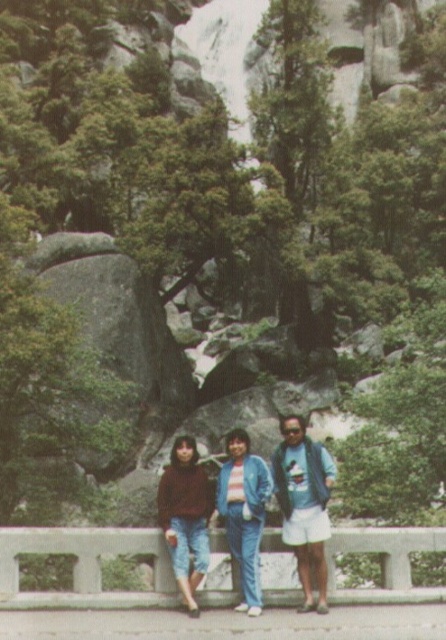
Between point (185, 548) and point (223, 467), which one is positioned behind?

Positioned behind is point (223, 467).

How much distance is there between matte brown sweater at lower left and blue denim pants at center?

matte brown sweater at lower left and blue denim pants at center are 3.94 feet apart.

The width and height of the screenshot is (446, 640). What do you see at coordinates (185, 516) in the screenshot? I see `matte brown sweater at lower left` at bounding box center [185, 516].

This screenshot has height=640, width=446. I want to click on matte brown sweater at lower left, so click(x=185, y=516).

Can you confirm if concrete at center is positioned to the left of matte blue jeans at center?

Incorrect, concrete at center is not on the left side of matte blue jeans at center.

Does concrete at center lie in front of matte blue jeans at center?

No, concrete at center is further to the viewer.

Does point (83, 580) lie in front of point (243, 452)?

Yes, it is.

At what (x,y) coordinates should I click in order to perform the action: click on concrete at center. Please return your answer as a coordinate pair (x, y). The width and height of the screenshot is (446, 640). Looking at the image, I should click on (83, 566).

Which is above, blue denim shorts at center or matte brown sweater at lower left?

matte brown sweater at lower left is above.

Does point (288, 497) lie behind point (206, 531)?

Yes, it is.

Locate an element on the screen. blue denim shorts at center is located at coordinates coord(304,502).